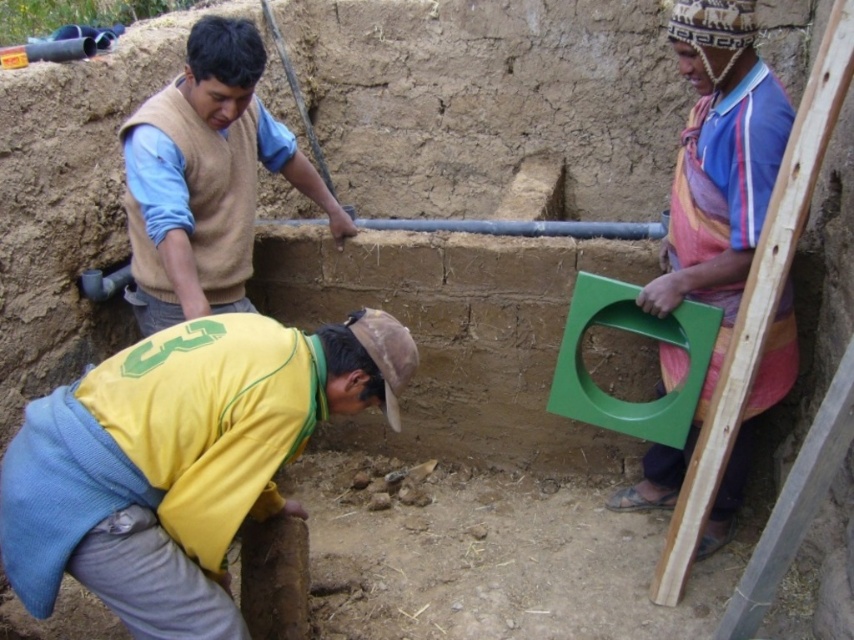
What is the position of the point with coordinates (179, 460) in relation to the yellow fabric at lower center?

The point with coordinates (179, 460) is on the yellow fabric at lower center.

You are standing in the middle of the scene and want to move towards the green plastic frame at right. Which direction should you turn to face the yellow fabric at lower center?

The yellow fabric at lower center is to the left of the green plastic frame at right. So, to face the yellow fabric at lower center from the green plastic frame at right, you should turn to your left.

You are a construction worker standing at the green plastic frame at right. You need to hand a tool to the person wearing the beige wool sweater at upper left. Can you reach them without moving from your current position?

The green plastic frame at right and beige wool sweater at upper left are 4.91 feet apart. Since the distance is about 5 feet, you cannot reach them without moving.